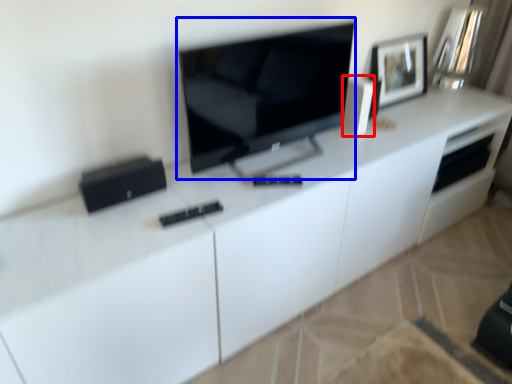
Question: Which point is further to the camera, appliance (highlighted by a red box) or television (highlighted by a blue box)?

Choices:
 (A) appliance
 (B) television

Answer: (A)